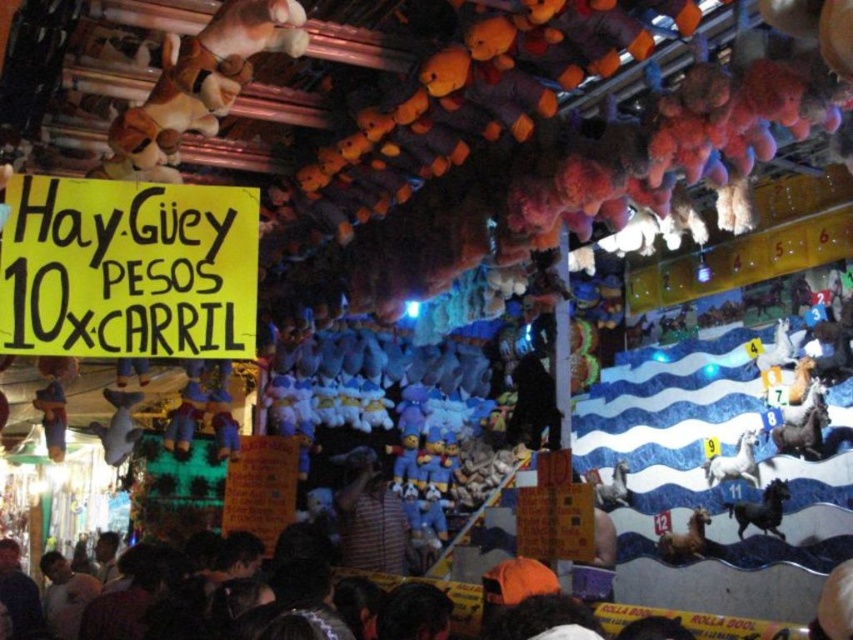
Who is more distant from viewer, (36, 625) or (721, 468)?

The point (36, 625) is behind.

Where is `dark brown leather cap at lower left`? dark brown leather cap at lower left is located at coordinates point(18,595).

Locate an element on the screen. Image resolution: width=853 pixels, height=640 pixels. dark brown leather cap at lower left is located at coordinates (18, 595).

This screenshot has width=853, height=640. Describe the element at coordinates (18, 595) in the screenshot. I see `dark brown leather cap at lower left` at that location.

Between point (7, 577) and point (782, 451), which one is positioned in front?

Point (782, 451)

At what (x,y) coordinates should I click in order to perform the action: click on dark brown leather cap at lower left. Please return your answer as a coordinate pair (x, y). This screenshot has width=853, height=640. Looking at the image, I should click on (18, 595).

Does striped shirt at center have a greater width compared to shiny metallic horse at center?

Indeed, striped shirt at center has a greater width compared to shiny metallic horse at center.

Which is more to the left, striped shirt at center or shiny metallic horse at center?

striped shirt at center is more to the left.

The width and height of the screenshot is (853, 640). I want to click on striped shirt at center, so click(370, 516).